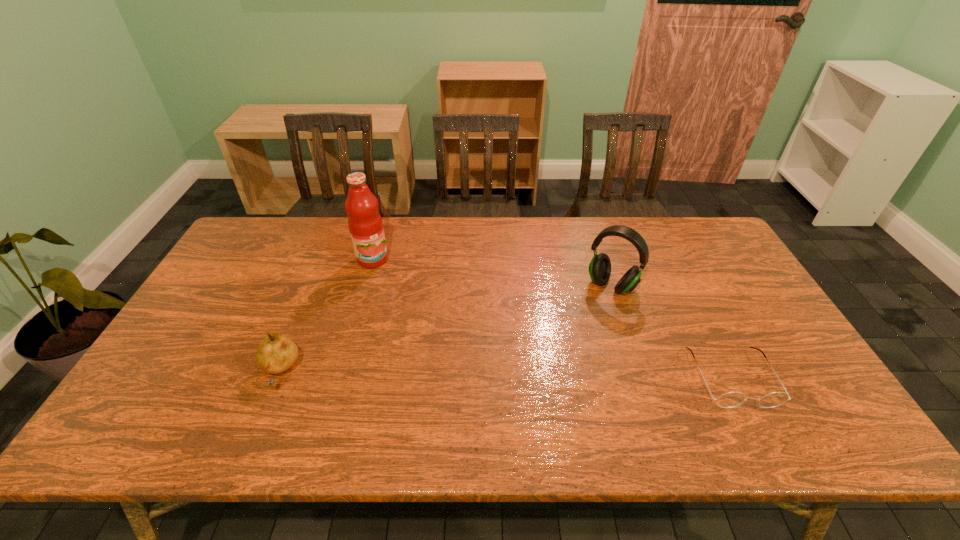
Identify the location of vacant space at the far edge of the desktop. The width and height of the screenshot is (960, 540). (568, 240).

In the image, there is a desktop. Where is `free region at the near edge`? free region at the near edge is located at coordinates (727, 386).

This screenshot has height=540, width=960. In order to click on blank space at the left edge of the desktop in this screenshot , I will do `click(226, 347)`.

Where is `vacant space at the right edge of the desktop`? vacant space at the right edge of the desktop is located at coordinates (699, 270).

The image size is (960, 540). I want to click on vacant space at the far right corner of the desktop, so click(x=670, y=230).

You are a GUI agent. You are given a task and a screenshot of the screen. Output one action in this format:
    pyautogui.click(x=<x>, y=<y>)
    Task: Click on the free point between the second tallest object and the shortest object
    The height and width of the screenshot is (540, 960).
    Given the screenshot: What is the action you would take?
    pyautogui.click(x=671, y=332)

The width and height of the screenshot is (960, 540). Identify the location of vacant region between the headset and the tallest object. (492, 272).

The image size is (960, 540). Identify the location of free area in between the spectacles and the third object from left to right. (671, 332).

The image size is (960, 540). I want to click on free space between the rightmost object and the fruit juice, so click(x=552, y=319).

The image size is (960, 540). I want to click on vacant space in between the second object from right to left and the leftmost object, so tap(445, 329).